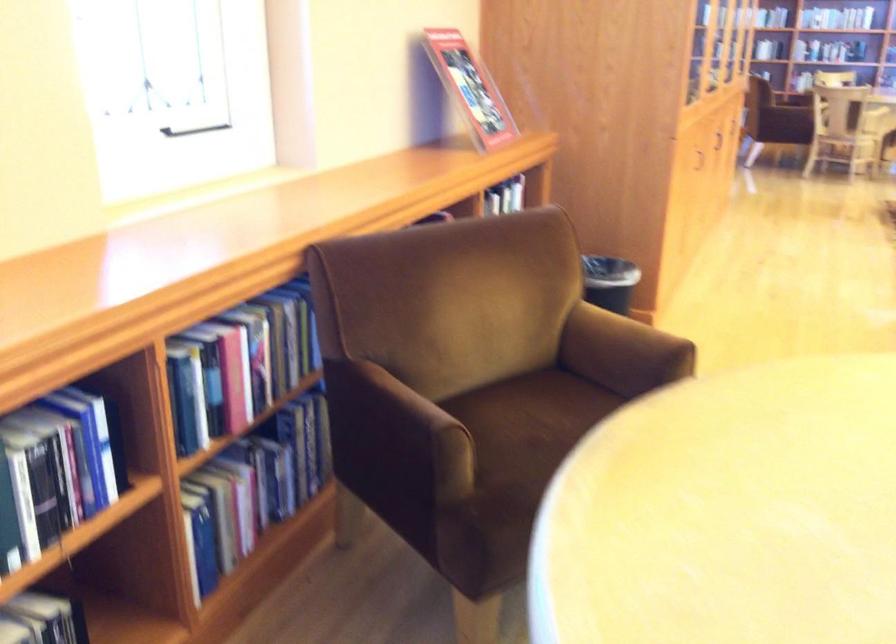
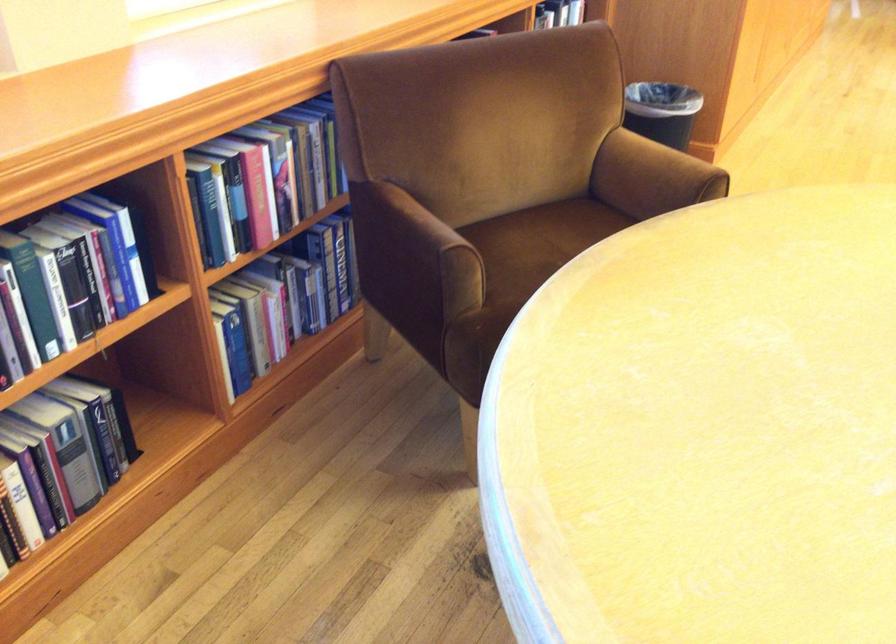
Find the pixel in the second image that matches (424,413) in the first image.

(435, 232)